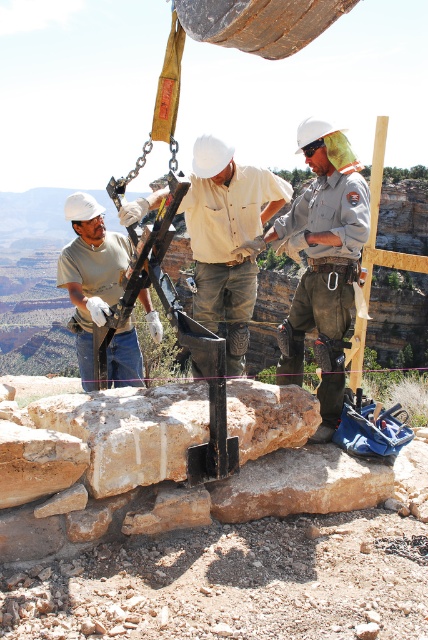
Question: Is khaki uniform at center behind matte black tool at left?

Choices:
 (A) yes
 (B) no

Answer: (B)

Question: Does khaki uniform at center come in front of matte black tool at left?

Choices:
 (A) no
 (B) yes

Answer: (B)

Question: Is khaki uniform at center to the left of matte black tool at left from the viewer's perspective?

Choices:
 (A) yes
 (B) no

Answer: (B)

Question: Which of the following is the closest to the observer?

Choices:
 (A) (332, 193)
 (B) (88, 252)

Answer: (A)

Question: Which point appears farthest from the camera in this image?

Choices:
 (A) (293, 317)
 (B) (83, 250)

Answer: (A)